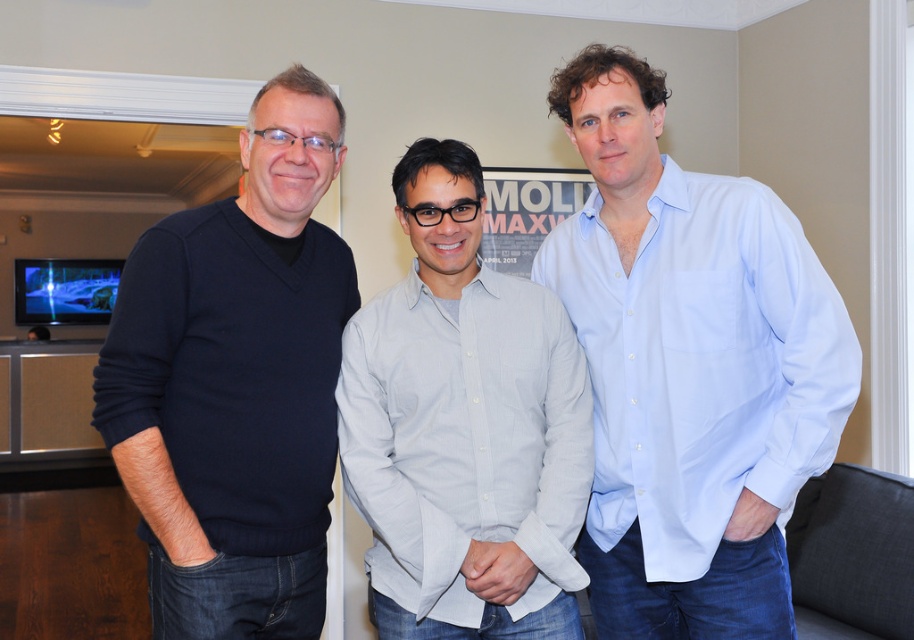
Can you confirm if light blue cotton shirt at center is positioned to the right of light gray cotton shirt at center?

Yes, light blue cotton shirt at center is to the right of light gray cotton shirt at center.

Does light blue cotton shirt at center have a lesser height compared to light gray cotton shirt at center?

No.

At what (x,y) coordinates should I click in order to perform the action: click on light blue cotton shirt at center. Please return your answer as a coordinate pair (x, y). Looking at the image, I should click on (689, 369).

At what (x,y) coordinates should I click in order to perform the action: click on dark blue sweater at left. Please return your answer as a coordinate pair (x, y). Looking at the image, I should click on (x=236, y=381).

Based on the photo, does dark blue sweater at left have a lesser height compared to light gray cotton shirt at center?

Incorrect, dark blue sweater at left's height does not fall short of light gray cotton shirt at center's.

Between point (228, 620) and point (443, 520), which one is positioned behind?

Positioned behind is point (443, 520).

The image size is (914, 640). I want to click on dark blue sweater at left, so click(236, 381).

Which is more to the left, light blue cotton shirt at center or dark blue sweater at left?

Positioned to the left is dark blue sweater at left.

What do you see at coordinates (689, 369) in the screenshot?
I see `light blue cotton shirt at center` at bounding box center [689, 369].

This screenshot has height=640, width=914. Identify the location of light blue cotton shirt at center. (689, 369).